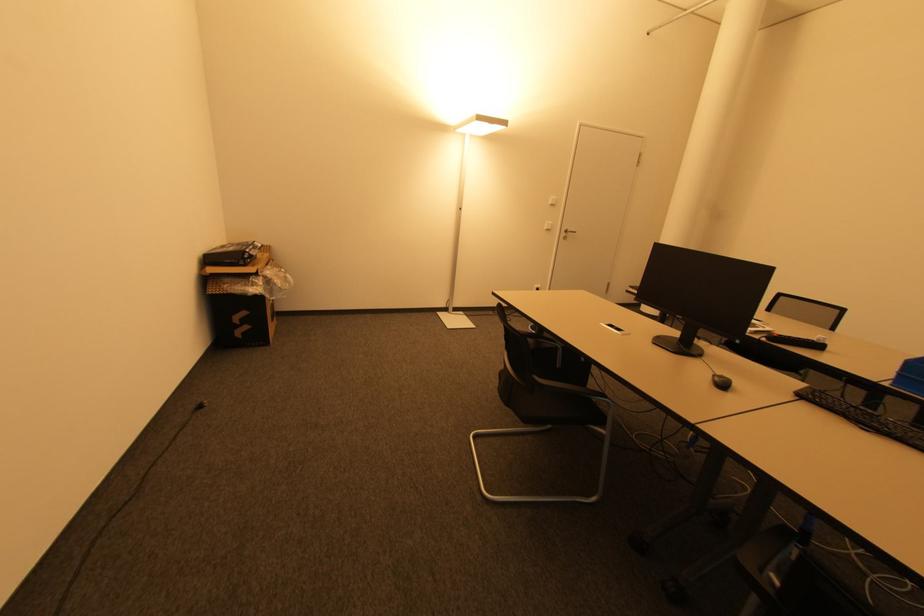
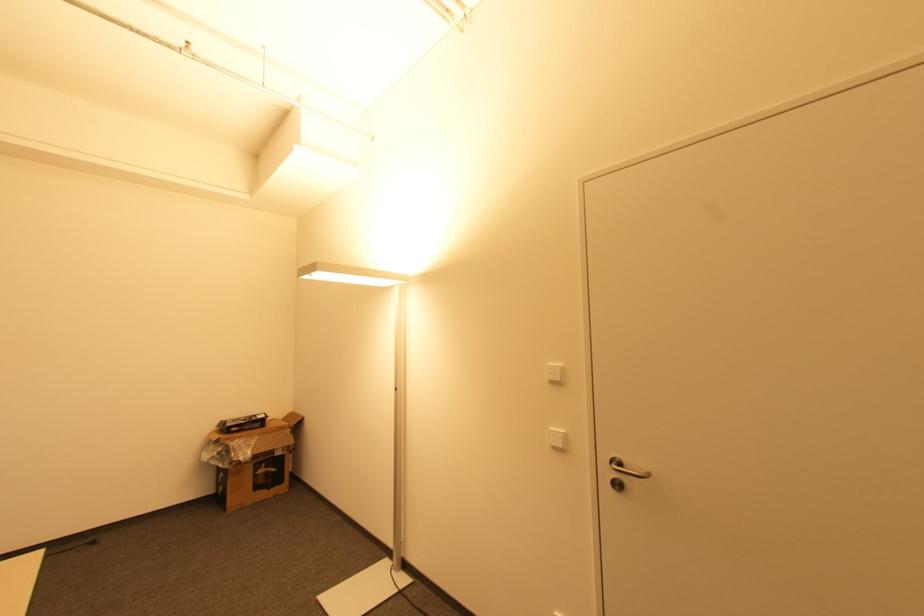
In the second image, find the point that corresponds to (x=553, y=206) in the first image.

(554, 383)